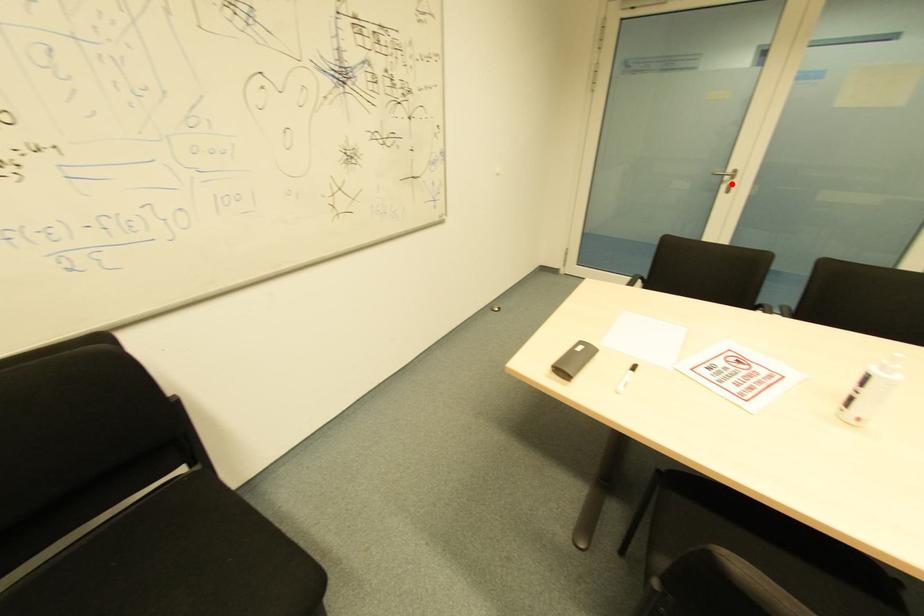
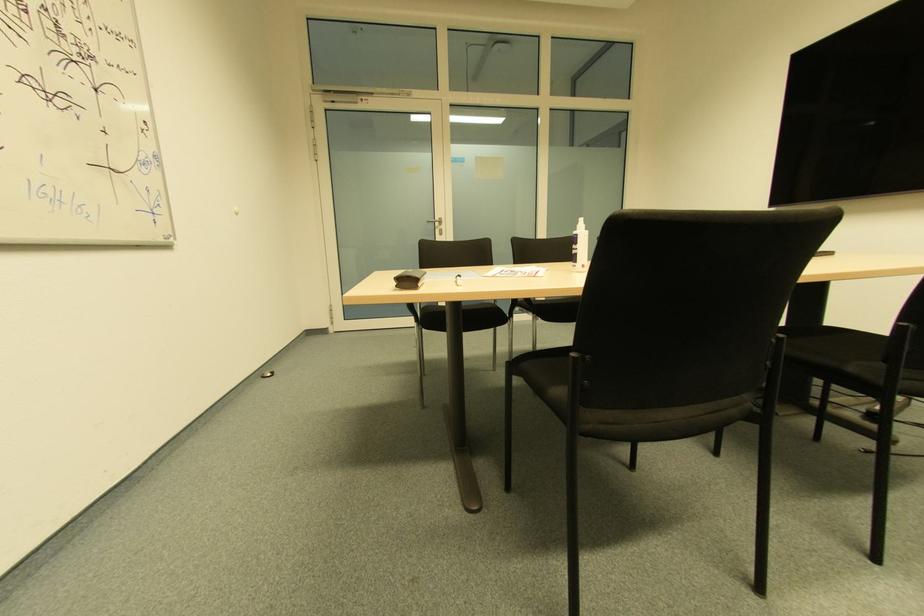
Locate, in the second image, the point that corresponds to the highlighted location in the first image.

(440, 230)